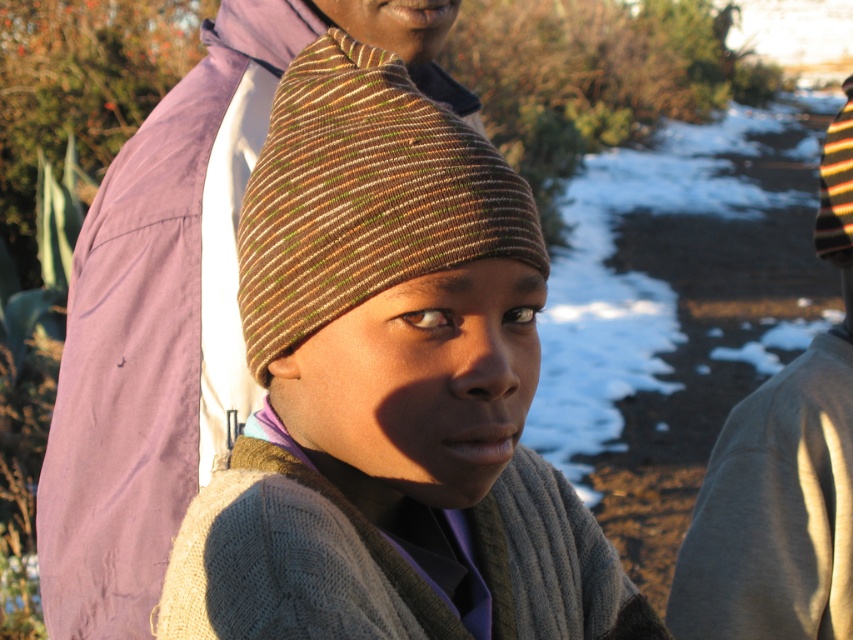
Consider the image. Who is more forward, (714, 132) or (824, 512)?

Positioned in front is point (824, 512).

In the scene shown: Between white powdery snow at center and gray cotton sweater at right, which one has less height?

With less height is gray cotton sweater at right.

Which is behind, point (593, 321) or point (708, 525)?

Positioned behind is point (593, 321).

Locate an element on the screen. The width and height of the screenshot is (853, 640). white powdery snow at center is located at coordinates (650, 269).

Can you confirm if striped knit beanie at center is positioned to the left of gray cotton sweater at right?

Correct, you'll find striped knit beanie at center to the left of gray cotton sweater at right.

This screenshot has height=640, width=853. Find the location of `striped knit beanie at center`. striped knit beanie at center is located at coordinates (364, 196).

Who is more forward, (497, 456) or (672, 428)?

Point (497, 456) is in front.

Is point (474, 298) positioned before point (714, 216)?

Yes, it is in front of point (714, 216).

Who is more forward, (189, 508) or (809, 292)?

Point (189, 508)

In order to click on knitted brown beanie at center in this screenshot , I will do `click(389, 392)`.